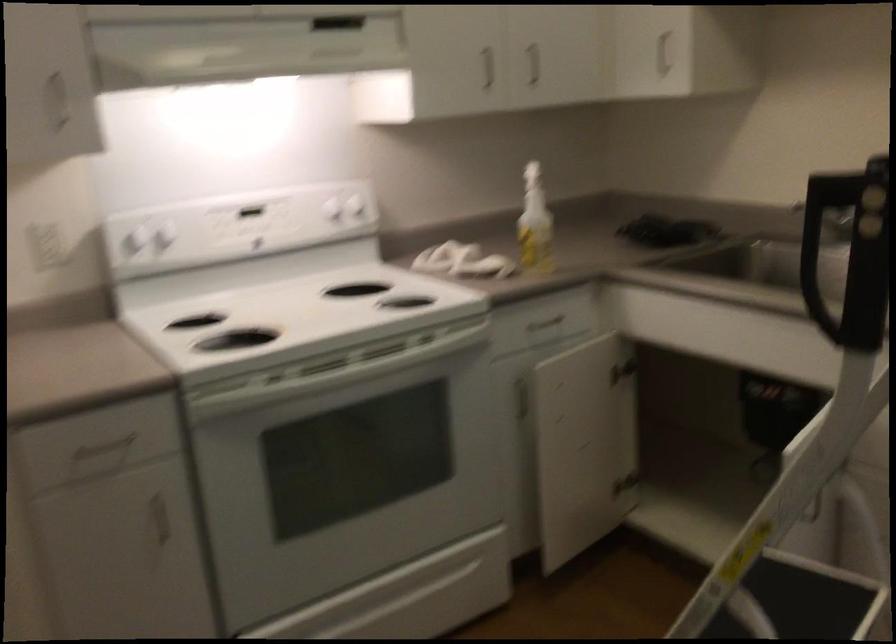
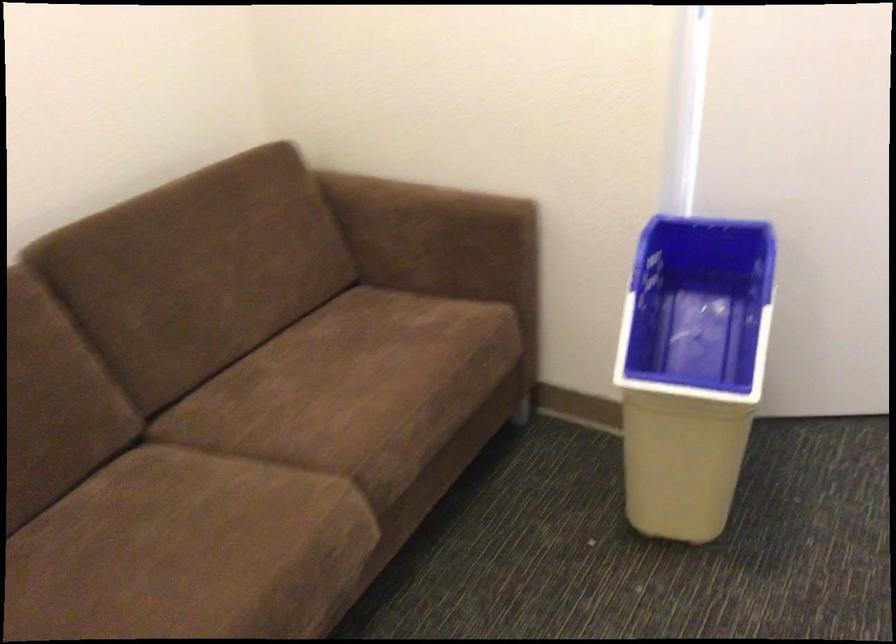
Based on the continuous images, in which direction is the camera rotating?

The camera rotated toward right-down.